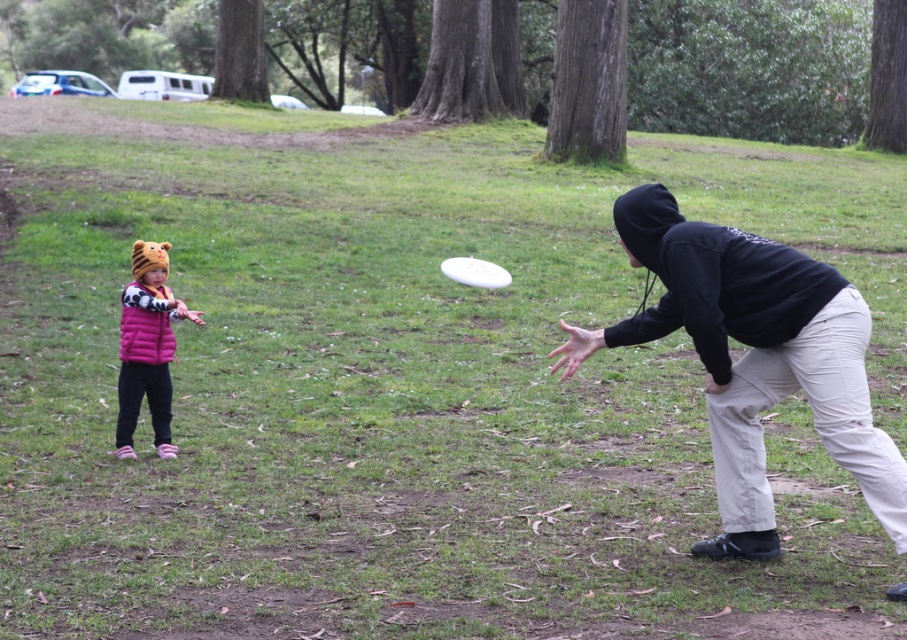
Question: Does pink puffy vest at left lie behind white plastic frisbee at center?

Choices:
 (A) yes
 (B) no

Answer: (B)

Question: Which is farther from the white plastic frisbee at center?

Choices:
 (A) black matte hoodie at center
 (B) pink puffy vest at left

Answer: (A)

Question: Among these points, which one is farthest from the camera?

Choices:
 (A) pos(122,388)
 (B) pos(805,378)
 (C) pos(494,275)

Answer: (C)

Question: Is black matte hoodie at center thinner than white plastic frisbee at center?

Choices:
 (A) yes
 (B) no

Answer: (B)

Question: Which point is closer to the camera taking this photo?

Choices:
 (A) (163, 253)
 (B) (715, 481)

Answer: (B)

Question: Can you confirm if black matte hoodie at center is smaller than pink puffy vest at left?

Choices:
 (A) no
 (B) yes

Answer: (A)